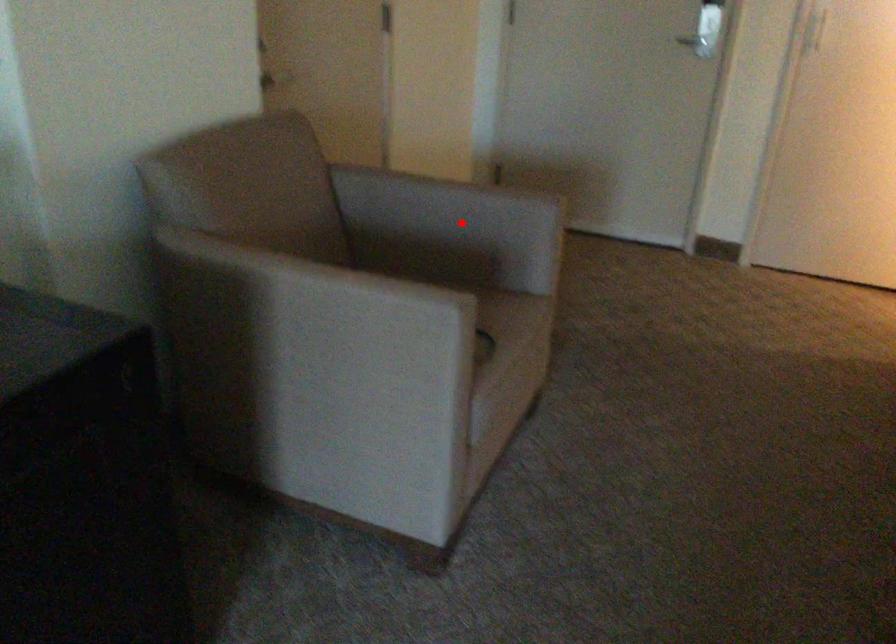
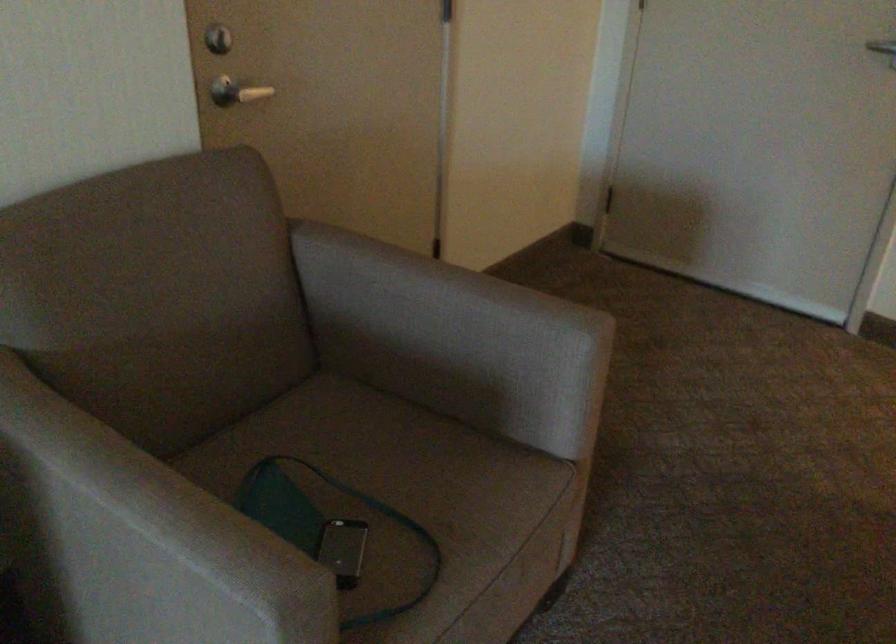
Question: A red point is marked in image1. In image2, is the corresponding 3D point closer to the camera or farther? Reply with the corresponding letter.

Choices:
 (A) The corresponding 3D point is closer.
 (B) The corresponding 3D point is farther.

Answer: (A)